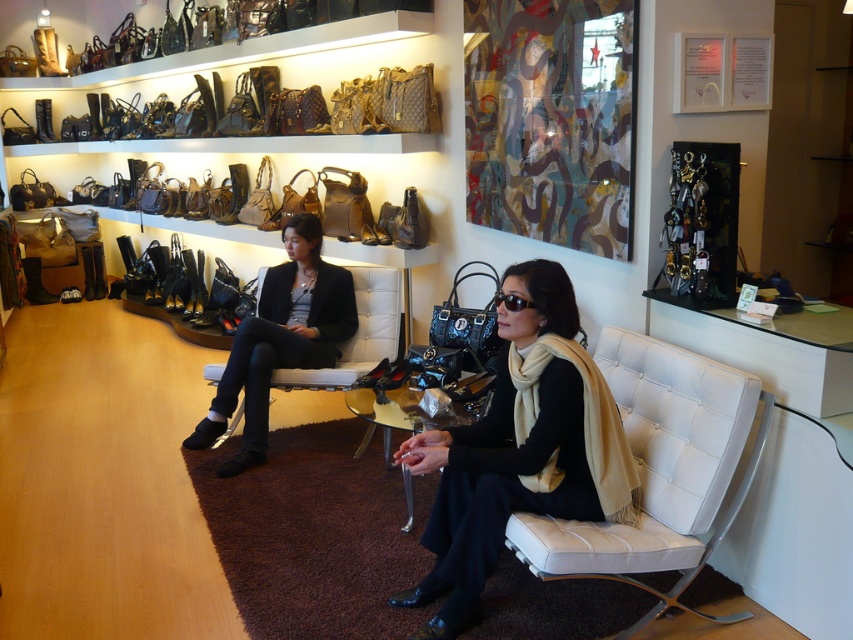
You are a salesperson in the boutique and need to place the black leather scarf at center and the black leather shoes at center into a display case. The case has a height limit of 30 cm. Can you fit both items vertically without stacking?

The black leather scarf at center has a smaller size compared to black leather shoes at center, but the exact dimensions are not provided. Therefore, it is uncertain if both items can fit vertically in the display case without stacking.

You are a customer in the boutique and want to sit on the white leather chair at center. To get there, you need to walk around the black leather shoes at center. Which direction should you move relative to the shoes to reach the chair?

The white leather chair at center is to the right of the black leather shoes at center. Therefore, you should move to the right side of the black leather shoes at center to reach the white leather chair at center.

You are a customer in the boutique and want to pick up the black leather scarf at center and the white leather chair at center. Which item is closer to you?

The black leather scarf at center is closer to you because it is further to the viewer than the white leather chair at center.